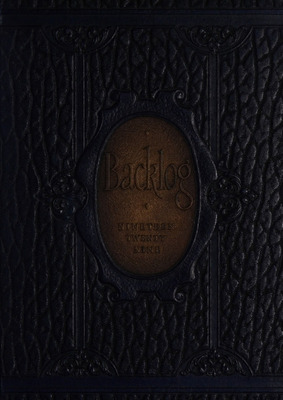
The height and width of the screenshot is (400, 283). In order to click on dark wooden background in this screenshot , I will do `click(33, 76)`, `click(266, 215)`, `click(134, 342)`.